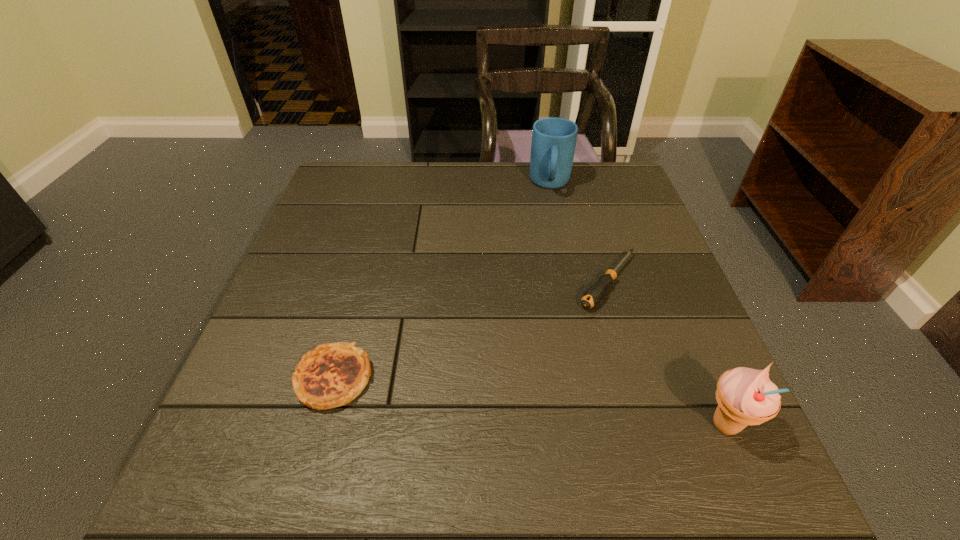
Identify the location of free location at the far edge. The width and height of the screenshot is (960, 540). (435, 164).

Find the location of a particular element. This screenshot has height=540, width=960. free space at the near edge of the desktop is located at coordinates (417, 403).

I want to click on free space at the left edge of the desktop, so click(338, 255).

Find the location of a particular element. This screenshot has height=540, width=960. vacant area at the right edge of the desktop is located at coordinates (685, 376).

Where is `free location at the far left corner`? free location at the far left corner is located at coordinates (346, 181).

The height and width of the screenshot is (540, 960). What are the coordinates of `blank space at the far right corner` in the screenshot? It's located at (625, 184).

This screenshot has width=960, height=540. Identify the location of free space between the rightmost object and the quiche. (530, 401).

The width and height of the screenshot is (960, 540). Identify the location of vacant area that lies between the mug and the second farthest object. 579,233.

You are a GUI agent. You are given a task and a screenshot of the screen. Output one action in this format:
    pyautogui.click(x=<x>, y=<y>)
    Task: Click on the free space between the farthest object and the leftmost object
    The width and height of the screenshot is (960, 540).
    Given the screenshot: What is the action you would take?
    pyautogui.click(x=443, y=281)

Locate an element on the screen. empty space that is in between the third nearest object and the rightmost object is located at coordinates (666, 353).